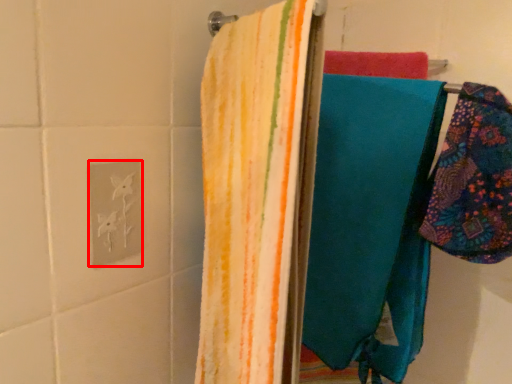
Question: Observing the image, what is the correct spatial positioning of electric outlet (annotated by the red box) in reference to towel?

Choices:
 (A) right
 (B) left

Answer: (B)